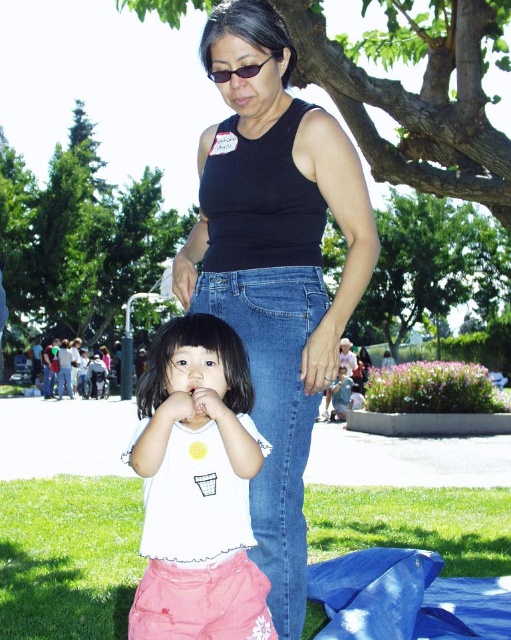
Does black matte tank top at center have a lesser width compared to white cotton shirt at center?

Incorrect, black matte tank top at center's width is not less than white cotton shirt at center's.

Does black matte tank top at center appear under white cotton shirt at center?

Incorrect, black matte tank top at center is not positioned below white cotton shirt at center.

In order to click on black matte tank top at center in this screenshot , I will do `click(274, 266)`.

Based on the photo, is black matte tank top at center positioned before black plastic sunglasses at upper center?

Yes, it is in front of black plastic sunglasses at upper center.

You are a GUI agent. You are given a task and a screenshot of the screen. Output one action in this format:
    pyautogui.click(x=<x>, y=<y>)
    Task: Click on the black matte tank top at center
    
    Given the screenshot: What is the action you would take?
    click(274, 266)

Is point (289, 522) positioned behind point (219, 83)?

Yes, point (289, 522) is behind point (219, 83).

Identify the location of black matte tank top at center. (274, 266).

Which of these two, white cotton shirt at center or black plastic sunglasses at upper center, stands shorter?

Standing shorter between the two is black plastic sunglasses at upper center.

Who is positioned more to the left, white cotton shirt at center or black plastic sunglasses at upper center?

white cotton shirt at center

Does point (258, 602) lie behind point (246, 68)?

No, it is not.

Where is `white cotton shirt at center`? This screenshot has width=511, height=640. white cotton shirt at center is located at coordinates (197, 488).